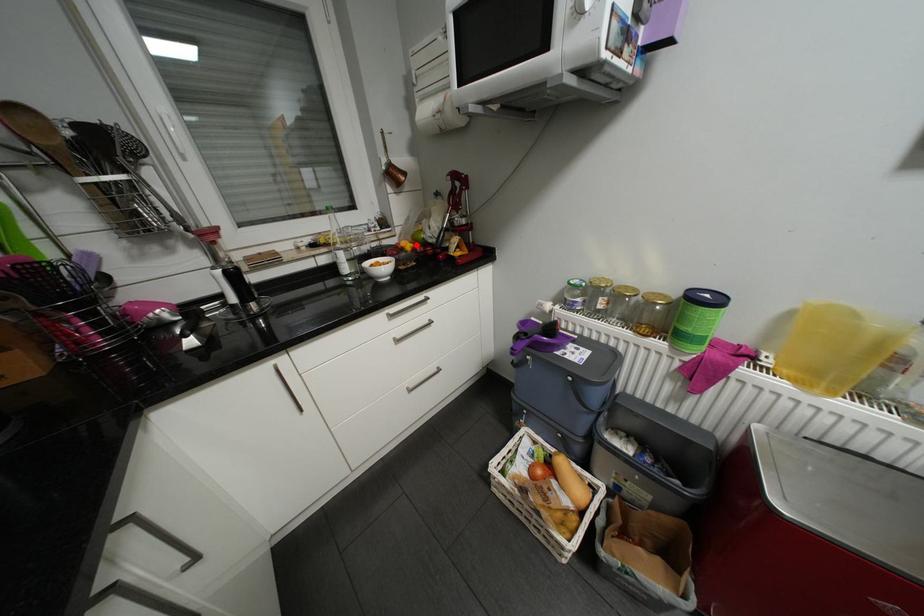
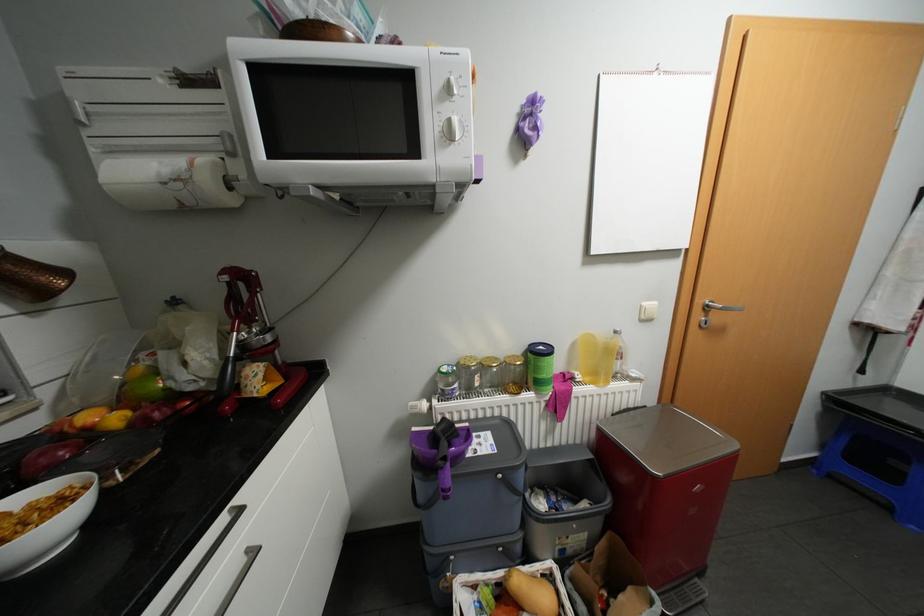
Where in the second image is the point corresponding to the highlighted location from the first image?

(123, 418)